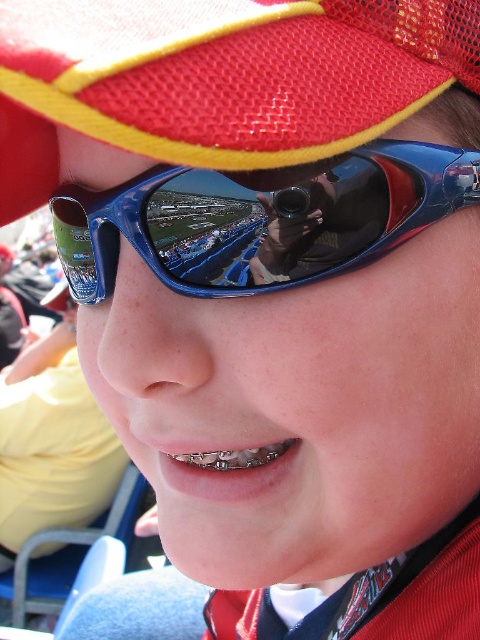
Which of these two, blue shiny sunglasses at center or black satin tie at lower right, stands taller?

blue shiny sunglasses at center

Consider the image. Is blue shiny sunglasses at center bigger than black satin tie at lower right?

Yes, blue shiny sunglasses at center is bigger than black satin tie at lower right.

Who is more distant from viewer, [93,193] or [333,621]?

The point [333,621] is more distant.

You are a GUI agent. You are given a task and a screenshot of the screen. Output one action in this format:
    pyautogui.click(x=<x>, y=<y>)
    Task: Click on the blue shiny sunglasses at center
    The width and height of the screenshot is (480, 640).
    Given the screenshot: What is the action you would take?
    pyautogui.click(x=260, y=220)

Does red mesh baseball cap at upper center have a lesser height compared to black satin tie at lower right?

In fact, red mesh baseball cap at upper center may be taller than black satin tie at lower right.

Image resolution: width=480 pixels, height=640 pixels. What do you see at coordinates (217, 77) in the screenshot?
I see `red mesh baseball cap at upper center` at bounding box center [217, 77].

This screenshot has width=480, height=640. Find the location of `red mesh baseball cap at upper center`. red mesh baseball cap at upper center is located at coordinates (217, 77).

Is point (215, 10) less distant than point (175, 280)?

Yes.

Is red mesh baseball cap at upper center wider than blue shiny sunglasses at center?

Yes, red mesh baseball cap at upper center is wider than blue shiny sunglasses at center.

The height and width of the screenshot is (640, 480). Find the location of `red mesh baseball cap at upper center`. red mesh baseball cap at upper center is located at coordinates (217, 77).

The height and width of the screenshot is (640, 480). I want to click on red mesh baseball cap at upper center, so click(x=217, y=77).